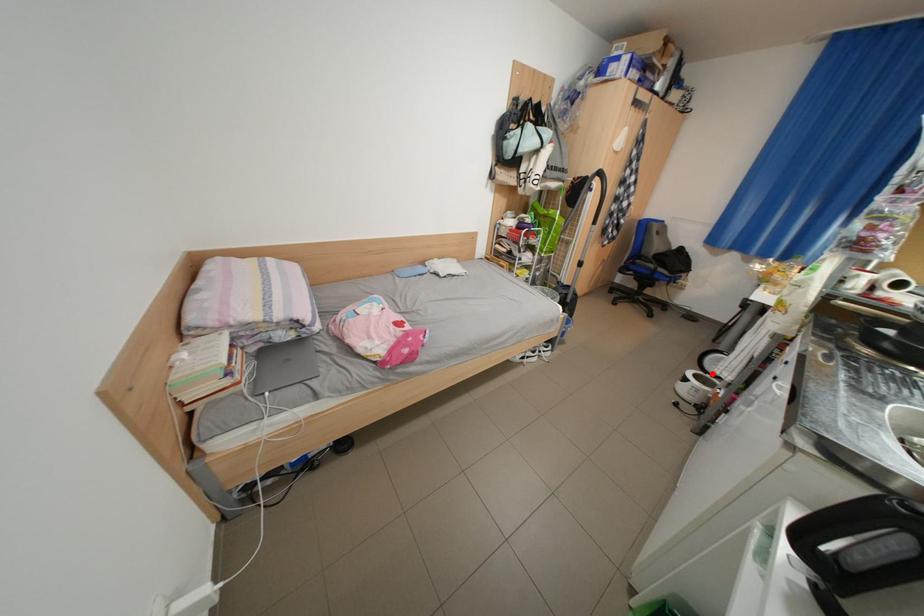
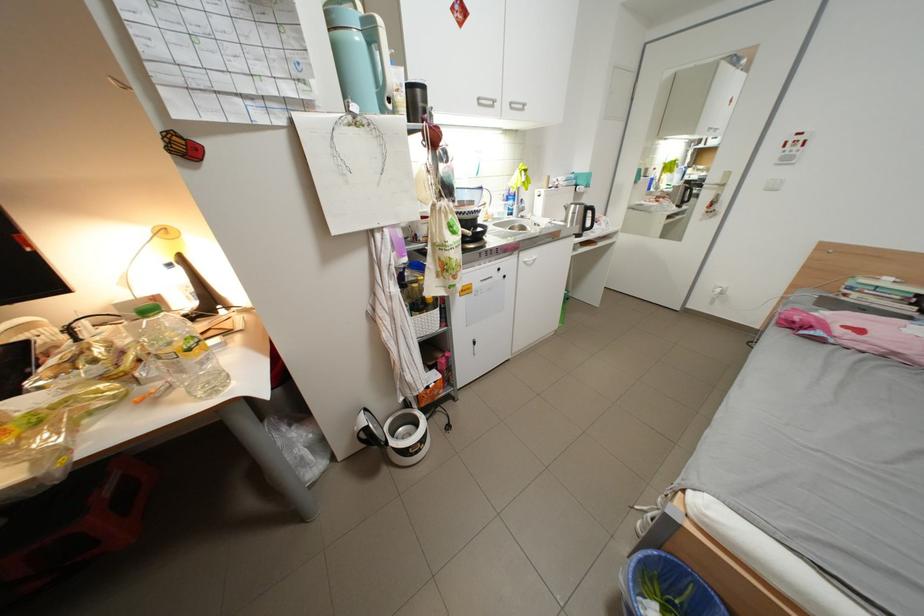
Question: I am providing you with two images of the same scene from different viewpoints. In image1, a red point is highlighted. Considering the same 3D point in image2, which of the following is correct?

Choices:
 (A) It is closer
 (B) It is farther

Answer: (A)